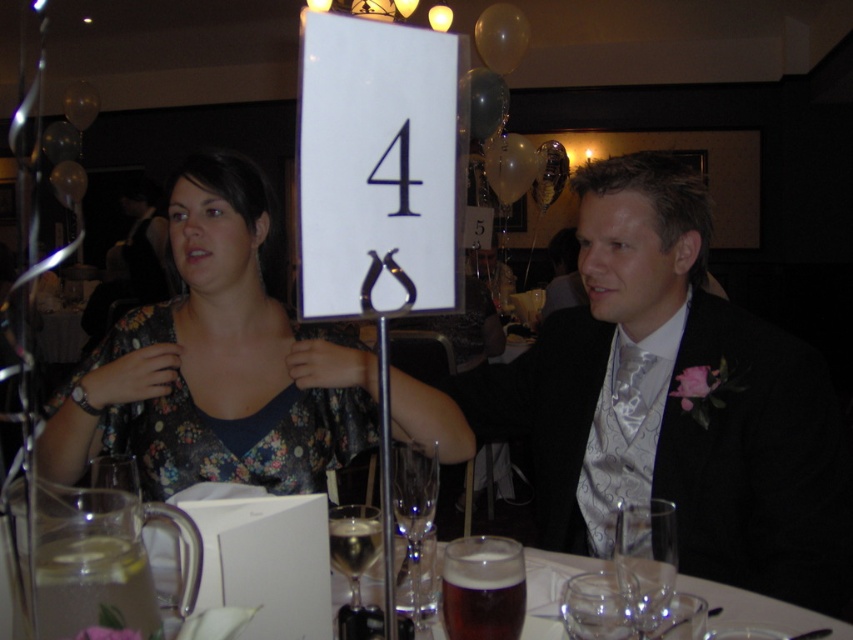
Question: Does floral fabric cocktail dress at center appear on the right side of clear glass wine glass at lower center?

Choices:
 (A) no
 (B) yes

Answer: (A)

Question: Does clear glass wine glass at center appear over transparent glass at lower center?

Choices:
 (A) yes
 (B) no

Answer: (A)

Question: Is floral dress at center below clear glass wine glass at center?

Choices:
 (A) yes
 (B) no

Answer: (B)

Question: Which object is closer to the camera taking this photo?

Choices:
 (A) clear glass wine glass at center
 (B) transparent glass at lower center
 (C) clear glass wine glass at lower center
 (D) dark brown glass at lower center

Answer: (A)

Question: Among these objects, which one is nearest to the camera?

Choices:
 (A) floral fabric cocktail dress at center
 (B) transparent glass at lower center
 (C) dark amber glass at lower center

Answer: (C)

Question: Which object is the closest to the clear glass wine glass at lower center?

Choices:
 (A) floral fabric cocktail dress at center
 (B) floral dress at center
 (C) dark brown glass at lower center

Answer: (C)